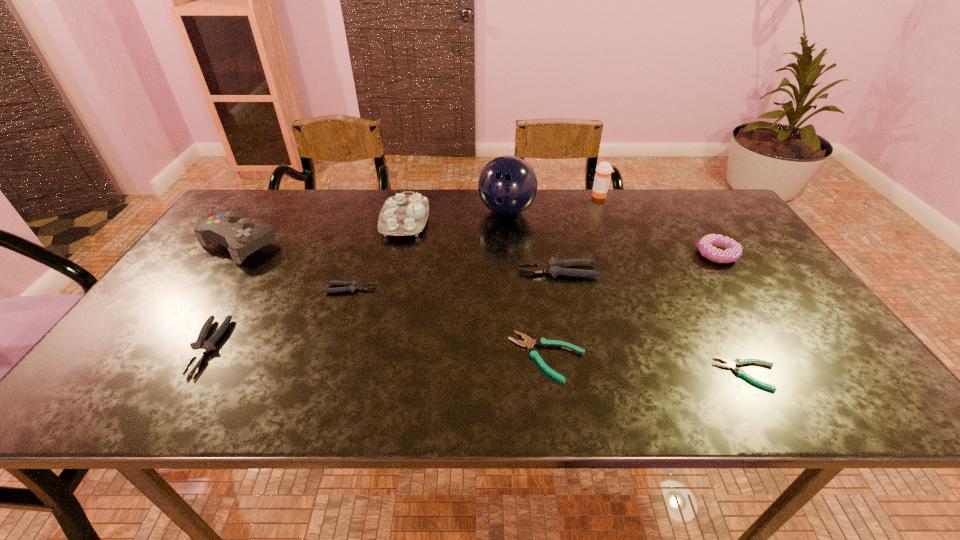
Where is `bowling ball present at the far edge`? bowling ball present at the far edge is located at coordinates (507, 185).

Identify the location of medicine that is positioned at the far edge. The image size is (960, 540). (603, 171).

Find the location of a particular element. This screenshot has height=540, width=960. chinaware that is at the far edge is located at coordinates (401, 215).

What are the coordinates of `control located at the far edge` in the screenshot? It's located at (232, 229).

This screenshot has height=540, width=960. Identify the location of control that is at the left edge. (232, 229).

Where is `pliers that is at the left edge`? The width and height of the screenshot is (960, 540). pliers that is at the left edge is located at coordinates (200, 347).

At what (x,y) coordinates should I click in order to perform the action: click on object at the right edge. Please return your answer as a coordinate pair (x, y). Image resolution: width=960 pixels, height=540 pixels. Looking at the image, I should click on (730, 250).

The image size is (960, 540). What are the coordinates of `object that is at the far left corner` in the screenshot? It's located at (232, 229).

What are the coordinates of `object present at the near left corner` in the screenshot? It's located at pos(200,347).

This screenshot has width=960, height=540. I want to click on free space at the far edge of the desktop, so click(613, 224).